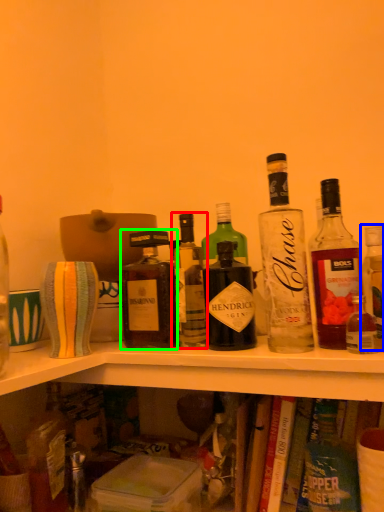
Question: Considering the real-world distances, which object is farthest from bottle (highlighted by a red box)? bottle (highlighted by a blue box) or bottle (highlighted by a green box)?

Choices:
 (A) bottle
 (B) bottle

Answer: (A)